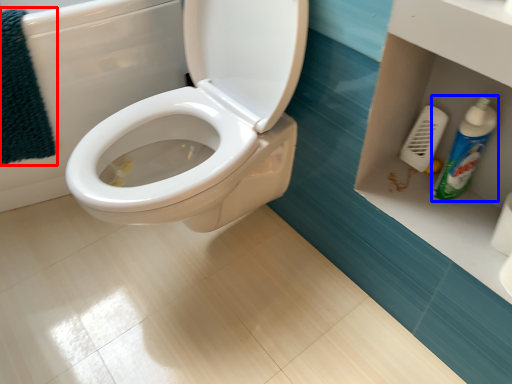
Question: Which of the following is the farthest to the observer, bath towel (highlighted by a red box) or cleaning product (highlighted by a blue box)?

Choices:
 (A) bath towel
 (B) cleaning product

Answer: (A)